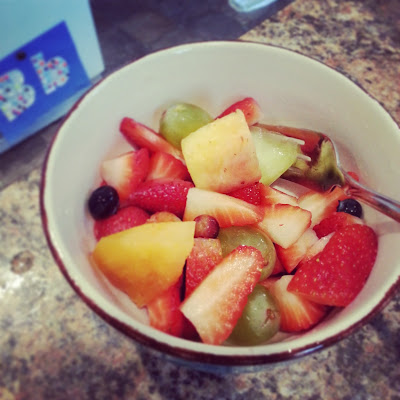
Where is `counter`? The width and height of the screenshot is (400, 400). counter is located at coordinates (345, 43).